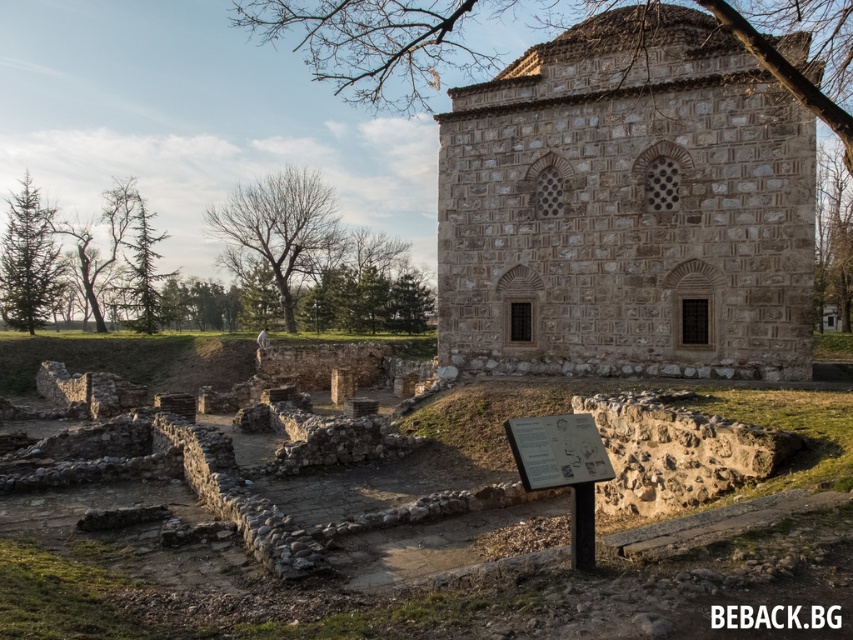
Locate an element on the screen. The image size is (853, 640). brown stone church at center is located at coordinates (627, 208).

Who is lower down, brown stone church at center or black text at center?

black text at center is lower down.

The image size is (853, 640). What do you see at coordinates (627, 208) in the screenshot? I see `brown stone church at center` at bounding box center [627, 208].

Identify the location of brown stone church at center. coord(627,208).